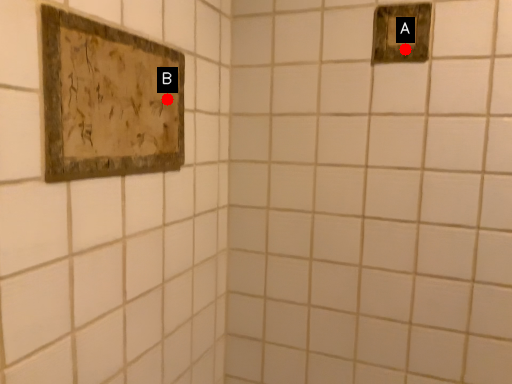
Question: Two points are circled on the image, labeled by A and B beside each circle. Which point is closer to the camera?

Choices:
 (A) A is closer
 (B) B is closer

Answer: (B)